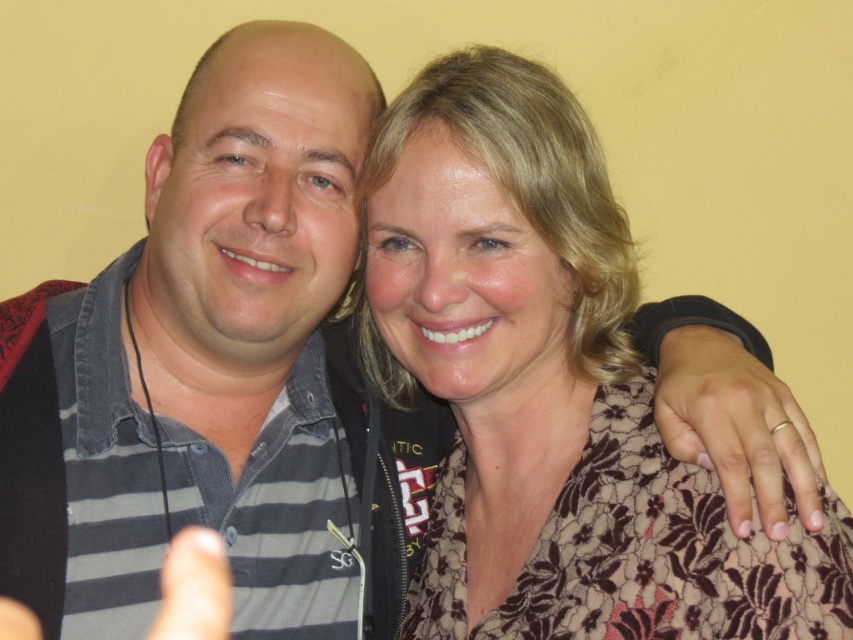
You are taking a photo of two people standing against a light yellow wall. You notice a matte black hand at lower left and a matte black thumb at lower left in the frame. Which object is positioned more to the left side of the photo?

The matte black hand at lower left is positioned more to the left side of the photo than the matte black thumb at lower left.

You are an interior designer observing the image. You need to determine the spatial relationship between the striped fabric shirt at left and the gold metallic ring at right. Which object is positioned higher in the image?

The striped fabric shirt at left is located above the gold metallic ring at right, so the striped fabric shirt at left is positioned higher in the image.